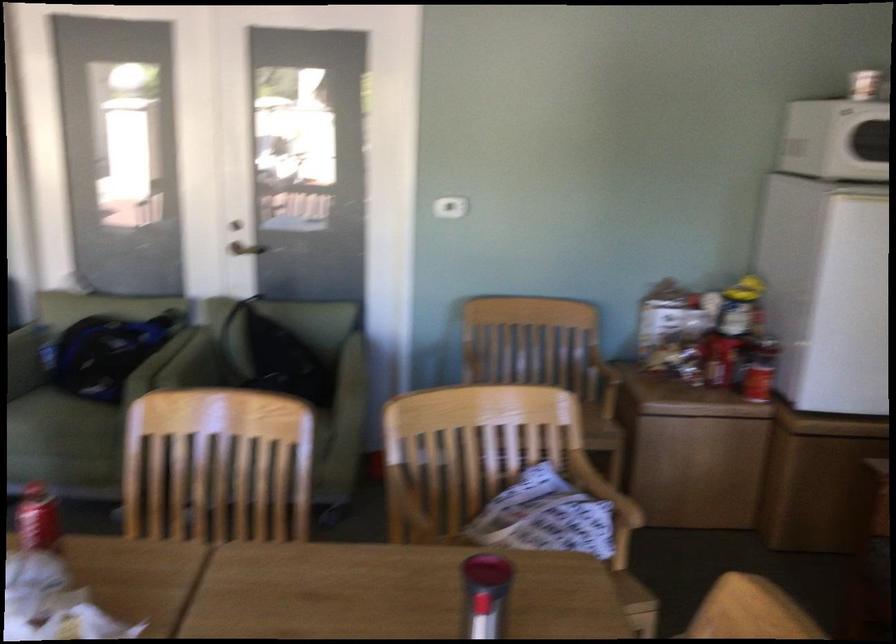
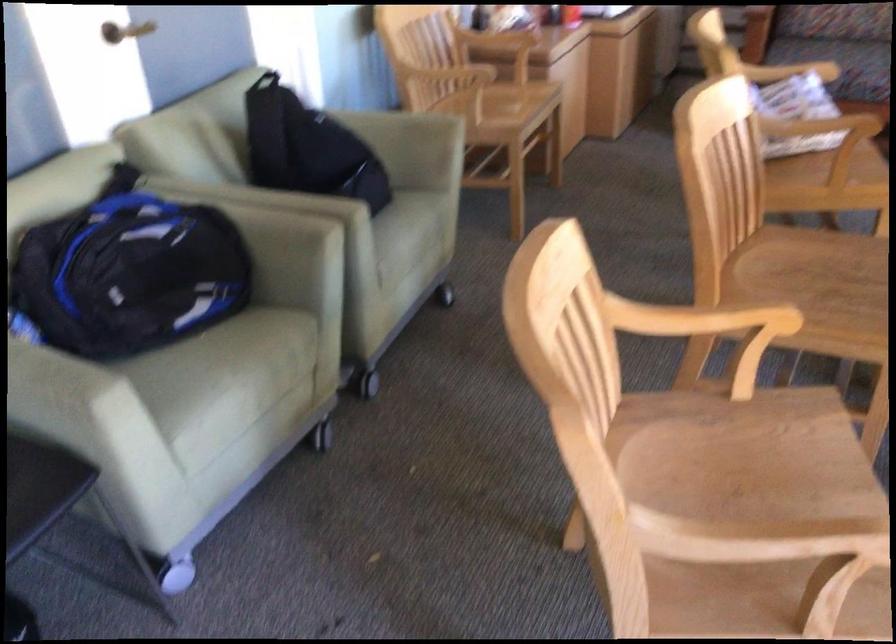
Where in the second image is the point corresponding to point (546, 514) from the first image?

(790, 71)